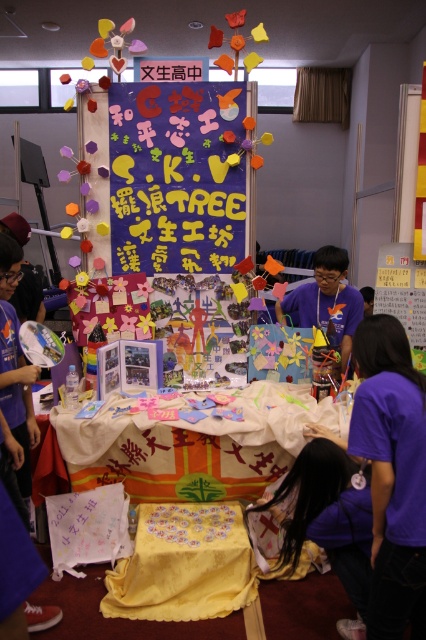
Looking at this image, you are setting up for an event and need to place a centerpiece on the yellow fabric table at center. According to the image, where exactly is the yellow fabric table positioned in the room?

The yellow fabric table at center is located at point (193, 448), so the centerpiece should be placed there.

You are setting up for an event and need to decide which item to move first. Since both the purple paperboard at center and the purple fabric at lower right are in the way, which one is smaller and thus easier to move?

The purple paperboard at center is smaller than the purple fabric at lower right, so it would be easier to move first.